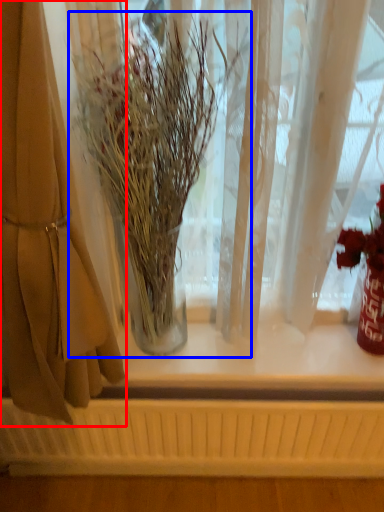
Question: Which point is further to the camera, curtain (highlighted by a red box) or houseplant (highlighted by a blue box)?

Choices:
 (A) curtain
 (B) houseplant

Answer: (B)